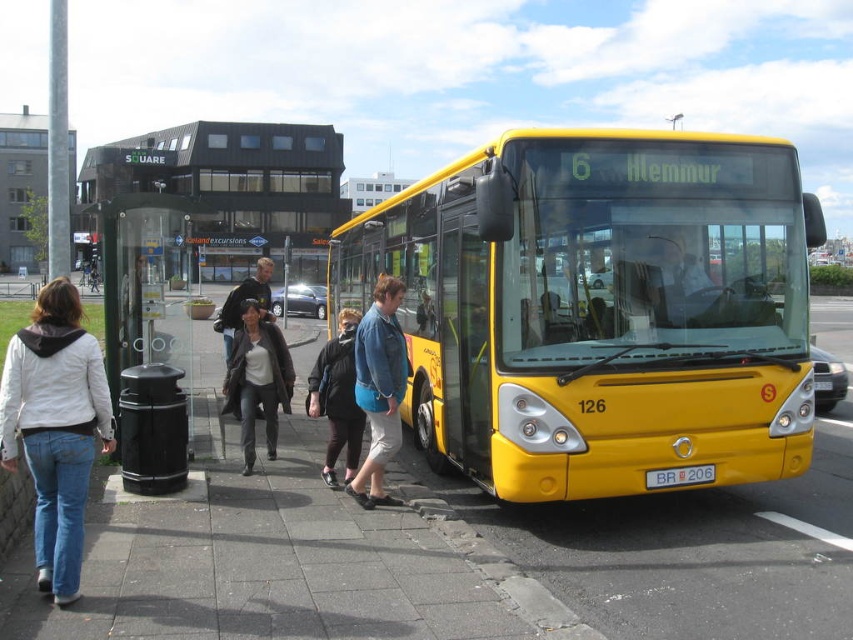
Question: Is denim jeans at lower left wider than denim jacket at center?

Choices:
 (A) no
 (B) yes

Answer: (B)

Question: Among these points, which one is nearest to the camera?

Choices:
 (A) (399, 355)
 (B) (247, 605)
 (C) (340, 394)
 (D) (1, 456)

Answer: (D)

Question: Which point is farther to the camera?

Choices:
 (A) paved concrete sidewalk at center
 (B) yellow matte bus at center

Answer: (B)

Question: Does denim jacket at center have a larger size compared to dark brown leather jacket at center?

Choices:
 (A) no
 (B) yes

Answer: (A)

Question: Does yellow matte bus at center have a larger size compared to denim jeans at lower left?

Choices:
 (A) no
 (B) yes

Answer: (B)

Question: Which object is farther from the camera taking this photo?

Choices:
 (A) black plastic bus stop at left
 (B) black fabric jacket at center
 (C) paved concrete sidewalk at center

Answer: (A)